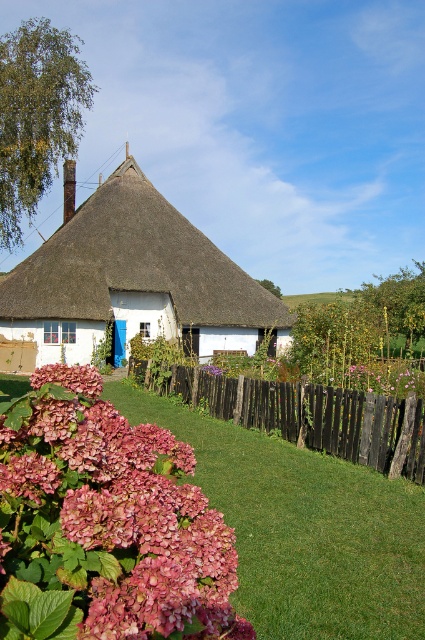
You are standing at the center of the lawn in front of the cottage. You want to place a new decorative stone at the exact center of the lawn. Where should you place it relative to the pink matte hydrangea at lower left?

The pink matte hydrangea at lower left is located at coordinates point (108, 518). To place the decorative stone at the exact center of the lawn, you should position it further to the right and slightly upwards from the pink matte hydrangea at lower left.

You are standing at the edge of the lawn in front of the white thatched roof at center and the black wooden fence at lower center. If you want to place a 10 feet long bench between them, will there be enough space?

The distance between the white thatched roof at center and the black wooden fence at lower center is 42.76 feet. Since the bench is only 10 feet long, there is more than enough space to place it between them.

You are a gardener who wants to plant a new flower bed near the pink matte hydrangea at lower left and the black wooden fence at lower center. Considering their heights, which one should you place taller plants next to?

You should place taller plants next to the black wooden fence at lower center because the pink matte hydrangea at lower left is shorter than the black wooden fence at lower center.